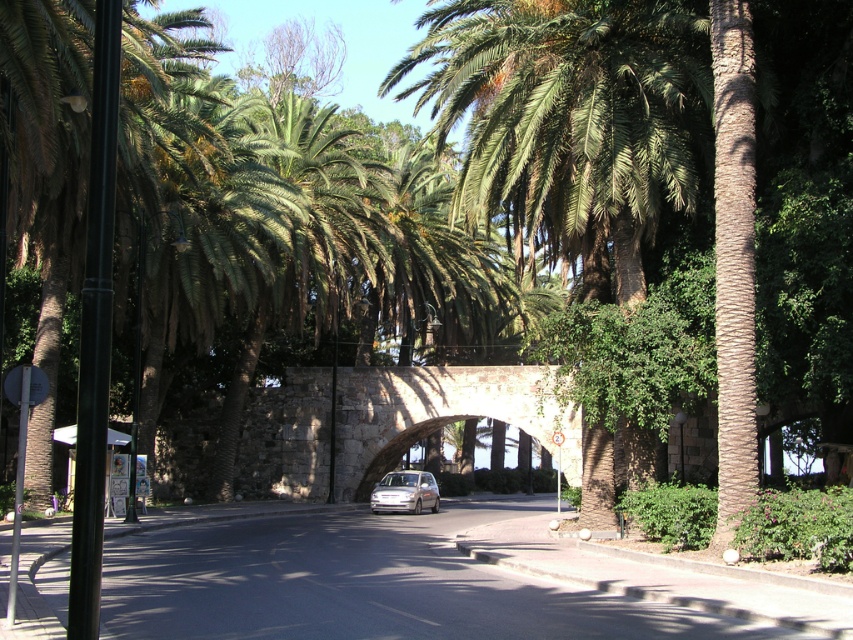
Between green leafy palm tree at center and satin silver car at center, which one appears on the left side from the viewer's perspective?

satin silver car at center is more to the left.

Is green leafy palm tree at center positioned before satin silver car at center?

Yes, green leafy palm tree at center is closer to the viewer.

This screenshot has height=640, width=853. What do you see at coordinates (567, 122) in the screenshot? I see `green leafy palm tree at center` at bounding box center [567, 122].

The image size is (853, 640). Identify the location of green leafy palm tree at center. (567, 122).

Between green leafy palm tree at center and stone archway at center, which one has more height?

Standing taller between the two is green leafy palm tree at center.

Between point (593, 186) and point (283, 483), which one is positioned in front?

Positioned in front is point (593, 186).

Who is more forward, (550, 125) or (486, 394)?

Point (550, 125) is in front.

Identify the location of green leafy palm tree at center. pyautogui.click(x=567, y=122).

Is point (390, 376) behind point (381, 477)?

That is True.

Image resolution: width=853 pixels, height=640 pixels. In order to click on stone archway at center in this screenshot , I will do `click(439, 413)`.

Who is more forward, (299, 470) or (413, 502)?

Point (413, 502) is in front.

You are a GUI agent. You are given a task and a screenshot of the screen. Output one action in this format:
    pyautogui.click(x=<x>, y=<y>)
    Task: Click on the stone archway at center
    
    Given the screenshot: What is the action you would take?
    pyautogui.click(x=439, y=413)